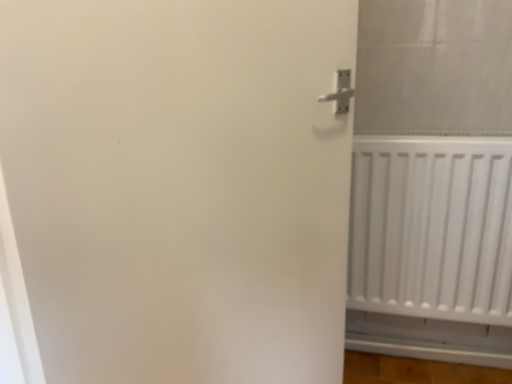
Locate an element on the screen. white matte radiator at right is located at coordinates (432, 227).

Describe the element at coordinates (432, 227) in the screenshot. The height and width of the screenshot is (384, 512). I see `white matte radiator at right` at that location.

The width and height of the screenshot is (512, 384). Describe the element at coordinates (179, 186) in the screenshot. I see `white matte door at right` at that location.

Measure the distance between point (301, 174) and camera.

A distance of 1.02 meters exists between point (301, 174) and camera.

Where is `white matte door at right`? Image resolution: width=512 pixels, height=384 pixels. white matte door at right is located at coordinates (179, 186).

Where is `white matte radiator at right`? The image size is (512, 384). white matte radiator at right is located at coordinates (432, 227).

Which is more to the right, white matte radiator at right or white matte door at right?

From the viewer's perspective, white matte radiator at right appears more on the right side.

Looking at this image, does white matte radiator at right come behind white matte door at right?

Yes, white matte radiator at right is further from the camera.

Which is closer to the camera, (458, 181) or (30, 174)?

Point (458, 181).

From the image's perspective, is white matte radiator at right beneath white matte door at right?

No, from the image's perspective, white matte radiator at right is not beneath white matte door at right.

From a real-world perspective, who is located lower, white matte radiator at right or white matte door at right?

In real-world perspective, white matte radiator at right is lower.

Between white matte radiator at right and white matte door at right, which one has smaller width?

white matte door at right is thinner.

Which of these two, white matte radiator at right or white matte door at right, stands shorter?

white matte radiator at right.

Based on the photo, who is smaller, white matte radiator at right or white matte door at right?

white matte radiator at right.

Looking at this image, is white matte radiator at right positioned beyond the bounds of white matte door at right?

That's correct, white matte radiator at right is outside of white matte door at right.

Is there a large distance between white matte radiator at right and white matte door at right?

white matte radiator at right is actually quite close to white matte door at right.

Looking at this image, is white matte radiator at right looking in the opposite direction of white matte door at right?

white matte radiator at right does not have its back to white matte door at right.

How distant is white matte radiator at right from white matte door at right?

They are 18.56 inches apart.

The image size is (512, 384). I want to click on door on the left of white matte radiator at right, so click(179, 186).

Considering the positions of objects white matte door at right and white matte radiator at right in the image provided, who is more to the right, white matte door at right or white matte radiator at right?

Positioned to the right is white matte radiator at right.

Between white matte door at right and white matte radiator at right, which one is positioned in front?

white matte door at right.

Which is in front, point (35, 181) or point (416, 307)?

The point (35, 181) is more forward.

From the image's perspective, between white matte door at right and white matte radiator at right, who is located below?

white matte door at right appears lower in the image.

From a real-world perspective, which object rests below the other?

white matte radiator at right.

Based on the photo, between white matte door at right and white matte radiator at right, which one has larger width?

With larger width is white matte radiator at right.

Can you confirm if white matte door at right is shorter than white matte radiator at right?

No, white matte door at right is not shorter than white matte radiator at right.

Which of these two, white matte door at right or white matte radiator at right, is smaller?

white matte radiator at right is smaller.

Can we say white matte door at right lies outside white matte radiator at right?

Indeed, white matte door at right is completely outside white matte radiator at right.

Are white matte door at right and white matte radiator at right beside each other?

white matte door at right is not next to white matte radiator at right, and they're not touching.

Is white matte door at right facing towards white matte radiator at right?

No, white matte door at right does not turn towards white matte radiator at right.

How different are the orientations of white matte door at right and white matte radiator at right in degrees?

The angle between the facing direction of white matte door at right and the facing direction of white matte radiator at right is 44.3 degrees.

Measure the distance from white matte door at right to white matte radiator at right.

They are 18.56 inches apart.

Find the location of a particular element. This screenshot has width=512, height=384. door to the left of white matte radiator at right is located at coordinates (179, 186).

Identify the location of radiator on the right of the white matte door at right. (432, 227).

At what (x,y) coordinates should I click in order to perform the action: click on radiator above the white matte door at right (from the image's perspective). Please return your answer as a coordinate pair (x, y). Looking at the image, I should click on (432, 227).